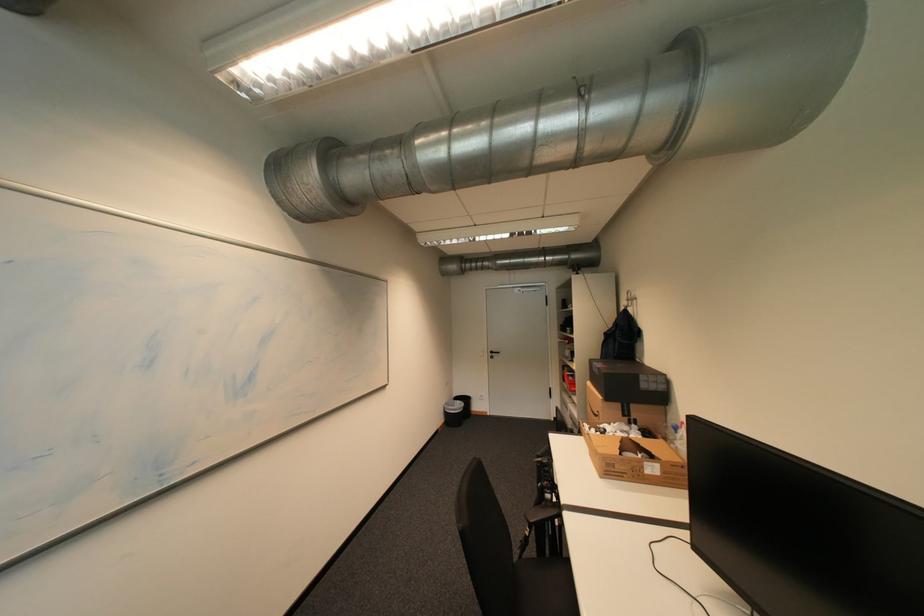
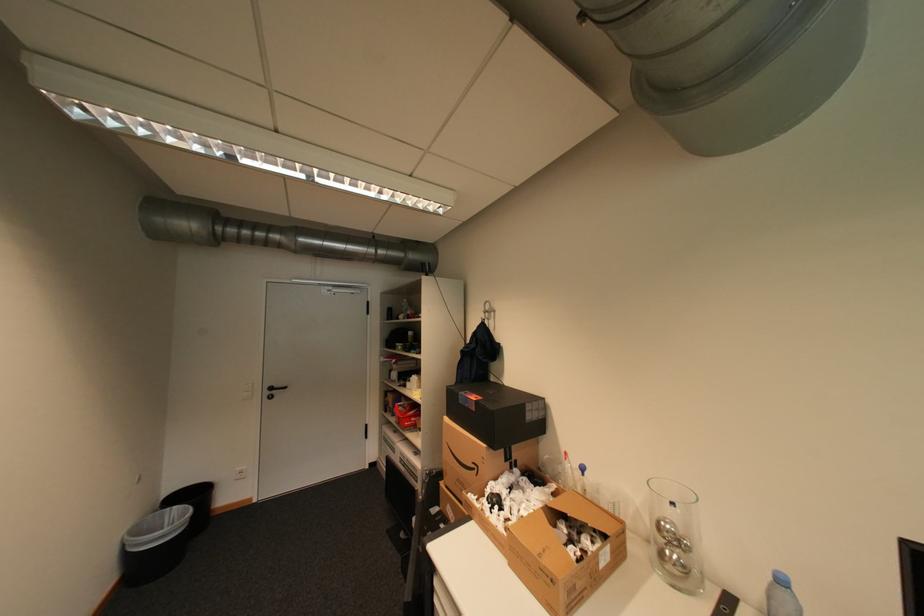
The point at [453,403] is marked in the first image. Where is the corresponding point in the second image?

(132, 531)